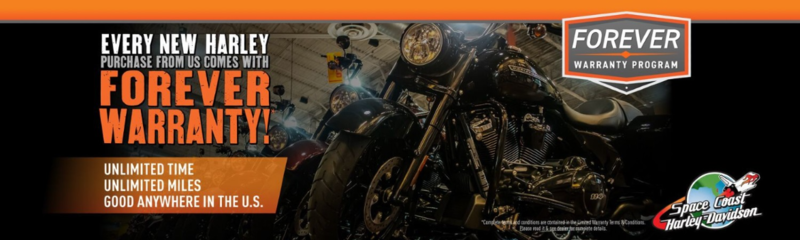
Find the location of a particular element. The width and height of the screenshot is (800, 240). ceiling is located at coordinates (301, 63).